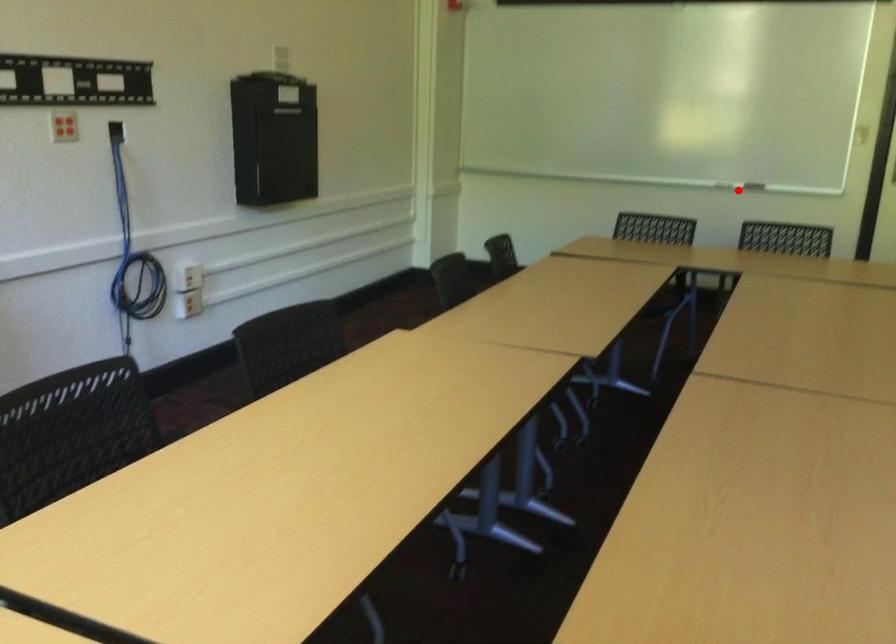
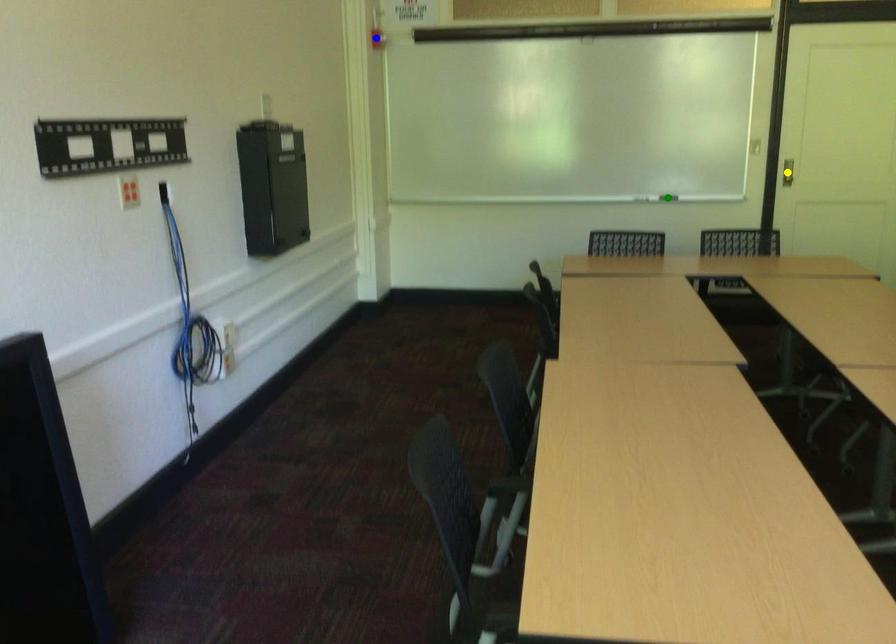
Question: I am providing you with two images of the same scene from different viewpoints. A red point is marked on the first image. You are given multiple points on the second image. Which spot in image 2 lines up with the point in image 1?

Choices:
 (A) yellow point
 (B) blue point
 (C) green point

Answer: (C)